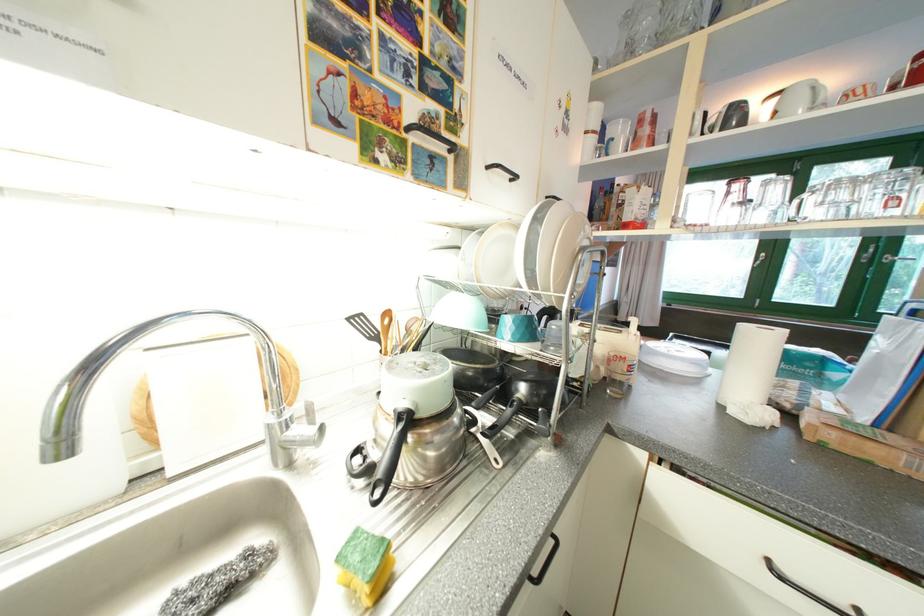
Where would you lift the white plate? Please return your answer as a coordinate pair (x, y).

(495, 261)